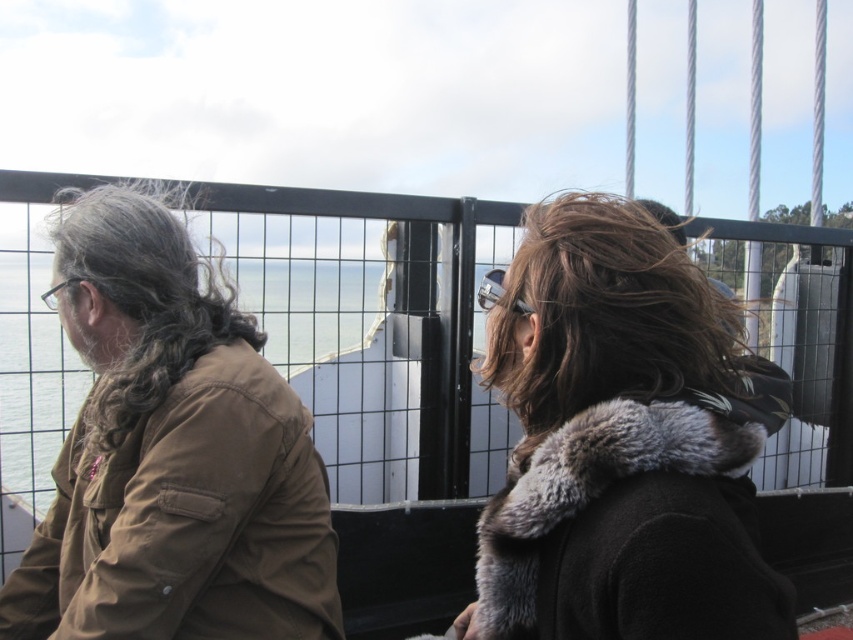
Question: Does black metal fence at upper center have a smaller size compared to dark brown fur coat at center?

Choices:
 (A) no
 (B) yes

Answer: (A)

Question: Among these objects, which one is nearest to the camera?

Choices:
 (A) black metal fence at upper center
 (B) dark brown fur coat at center

Answer: (B)

Question: Which point appears farthest from the camera in this image?

Choices:
 (A) (228, 317)
 (B) (537, 243)

Answer: (A)

Question: Based on their relative distances, which object is farther from the black metal fence at upper center?

Choices:
 (A) gray curly hair at left
 (B) brown fuzzy hair at center
 (C) dark brown fur coat at center

Answer: (C)

Question: Can you confirm if brown matte jacket at left is thinner than gray curly hair at left?

Choices:
 (A) no
 (B) yes

Answer: (A)

Question: Can you confirm if dark brown fur coat at center is positioned to the right of gray curly hair at left?

Choices:
 (A) yes
 (B) no

Answer: (A)